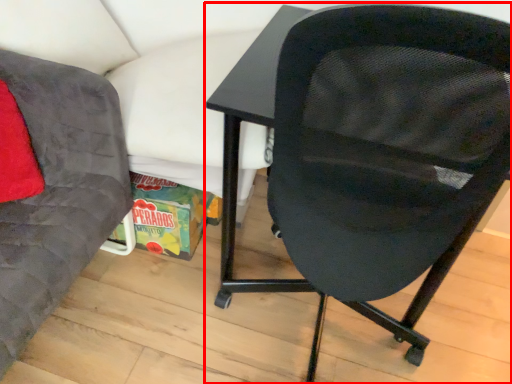
Question: Considering the relative positions of chair (annotated by the red box) and chair in the image provided, where is chair (annotated by the red box) located with respect to the staircase?

Choices:
 (A) left
 (B) right

Answer: (B)